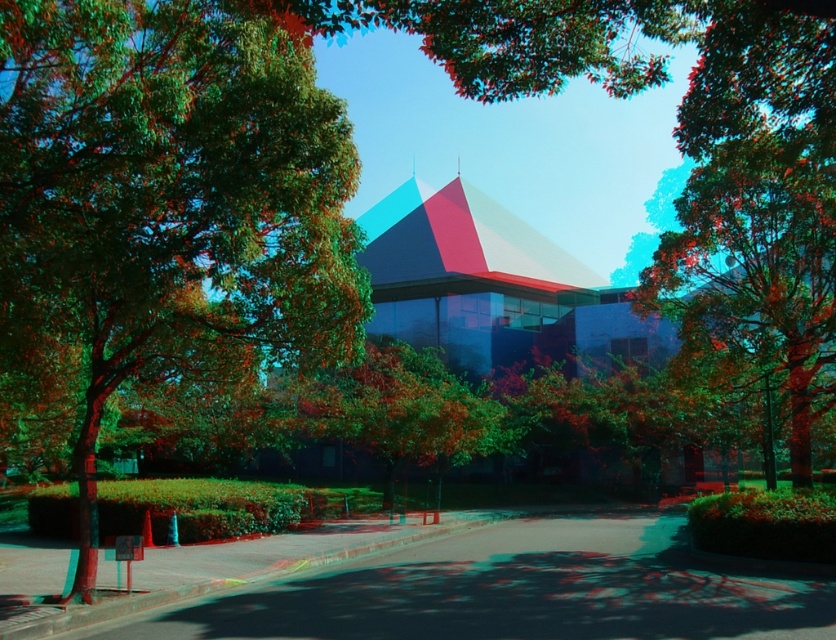
Can you confirm if green leafy tree at left is positioned to the left of green leafy tree at center?

Correct, you'll find green leafy tree at left to the left of green leafy tree at center.

Who is shorter, green leafy tree at left or green leafy tree at center?

Standing shorter between the two is green leafy tree at left.

Find the location of a particular element. The image size is (836, 640). green leafy tree at left is located at coordinates point(167,202).

Locate an element on the screen. green leafy tree at left is located at coordinates (167, 202).